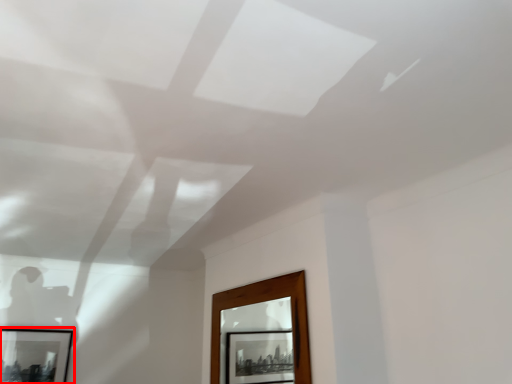
Question: From the image's perspective, what is the correct spatial positioning of picture frame (annotated by the red box) in reference to window?

Choices:
 (A) below
 (B) above

Answer: (A)